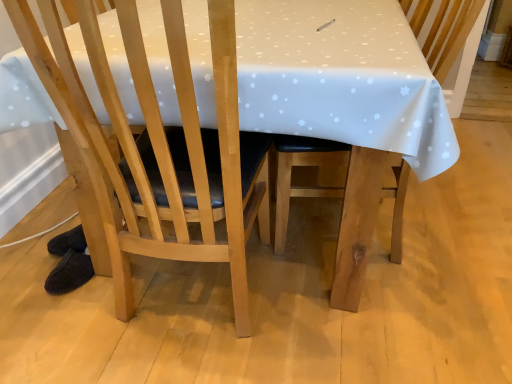
Question: From a real-world perspective, is light wood chair at center, marked as the 1th chair in a left-to-right arrangement, positioned above or below wooden chair at center, acting as the second chair starting from the left?

Choices:
 (A) below
 (B) above

Answer: (B)

Question: Is light wood chair at center, marked as the 1th chair in a left-to-right arrangement, in front of or behind wooden chair at center, the first chair when ordered from right to left, in the image?

Choices:
 (A) behind
 (B) front

Answer: (B)

Question: Visually, is light wood chair at center, marked as the 1th chair in a left-to-right arrangement, positioned to the left or to the right of wooden chair at center, acting as the second chair starting from the left?

Choices:
 (A) right
 (B) left

Answer: (B)

Question: From a real-world perspective, is wooden chair at center, the first chair when ordered from right to left, positioned above or below light wood chair at center, marked as the 1th chair in a left-to-right arrangement?

Choices:
 (A) below
 (B) above

Answer: (A)

Question: Considering the positions of wooden chair at center, the first chair when ordered from right to left, and light wood chair at center, marked as the second chair in a right-to-left arrangement, in the image, is wooden chair at center, the first chair when ordered from right to left, bigger or smaller than light wood chair at center, marked as the second chair in a right-to-left arrangement,?

Choices:
 (A) big
 (B) small

Answer: (A)

Question: Considering the relative positions of wooden chair at center, acting as the second chair starting from the left, and light wood chair at center, marked as the second chair in a right-to-left arrangement, in the image provided, is wooden chair at center, acting as the second chair starting from the left, to the left or to the right of light wood chair at center, marked as the second chair in a right-to-left arrangement,?

Choices:
 (A) right
 (B) left

Answer: (A)

Question: From the image's perspective, is wooden chair at center, the first chair when ordered from right to left, located above or below light wood chair at center, marked as the 1th chair in a left-to-right arrangement?

Choices:
 (A) above
 (B) below

Answer: (A)